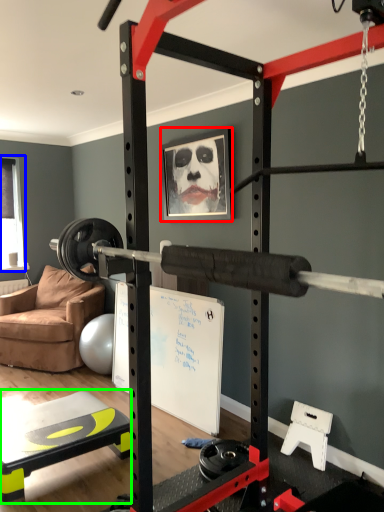
Question: Considering the real-world distances, which object is farthest from picture frame (highlighted by a red box)? window screen (highlighted by a blue box) or table (highlighted by a green box)?

Choices:
 (A) window screen
 (B) table

Answer: (A)